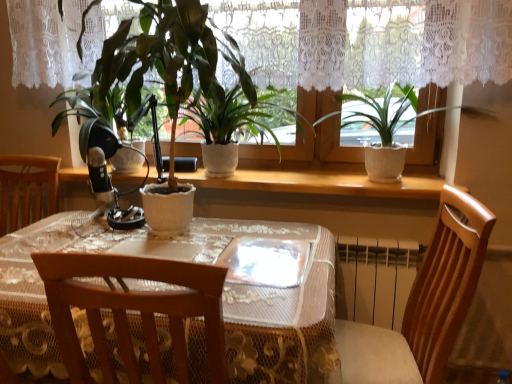
The height and width of the screenshot is (384, 512). I want to click on white ceramic plant pot at center, so click(320, 183).

The height and width of the screenshot is (384, 512). I want to click on white ceramic pot at center, which is counted as the second houseplant, starting from the right, so click(167, 75).

In order to click on white ceramic plant pot at center in this screenshot , I will do `click(320, 183)`.

Is the depth of white ceramic pot at center, arranged as the first houseplant when viewed from the left, greater than that of white textured pot at upper right, the first houseplant in the right-to-left sequence?

No, it is not.

From the image's perspective, is white ceramic pot at center, arranged as the first houseplant when viewed from the left, beneath white textured pot at upper right, the first houseplant in the right-to-left sequence?

Actually, white ceramic pot at center, arranged as the first houseplant when viewed from the left, appears above white textured pot at upper right, the first houseplant in the right-to-left sequence, in the image.

Is white ceramic pot at center, which is counted as the second houseplant, starting from the right, spatially inside white textured pot at upper right, which appears as the 2th houseplant when viewed from the left, or outside of it?

white ceramic pot at center, which is counted as the second houseplant, starting from the right, lies outside white textured pot at upper right, which appears as the 2th houseplant when viewed from the left.

Does wooden chair at lower right turn towards white lace tablecloth at center?

Yes, wooden chair at lower right is facing white lace tablecloth at center.

From a real-world perspective, is wooden chair at lower right located beneath white lace tablecloth at center?

No.

Considering the sizes of objects wooden chair at lower right and white lace tablecloth at center in the image provided, who is shorter, wooden chair at lower right or white lace tablecloth at center?

With less height is white lace tablecloth at center.

Can you confirm if wooden chair at lower right is smaller than white lace tablecloth at center?

Correct, wooden chair at lower right occupies less space than white lace tablecloth at center.

Does white lace tablecloth at center have a lesser width compared to white ceramic plant pot at center?

No.

From the image's perspective, which one is positioned higher, white lace tablecloth at center or white ceramic plant pot at center?

white ceramic plant pot at center is shown above in the image.

Is white lace tablecloth at center completely or partially outside of white ceramic plant pot at center?

white lace tablecloth at center is positioned outside white ceramic plant pot at center.

Is point (10, 246) less distant than point (392, 197)?

Yes, it is in front of point (392, 197).

Is white ceramic plant pot at center at the left side of white textured pot at upper right, which appears as the 2th houseplant when viewed from the left?

Yes, white ceramic plant pot at center is to the left of white textured pot at upper right, which appears as the 2th houseplant when viewed from the left.

Is white ceramic plant pot at center aimed at white textured pot at upper right, the first houseplant in the right-to-left sequence?

No, white ceramic plant pot at center is not oriented towards white textured pot at upper right, the first houseplant in the right-to-left sequence.

Is white textured pot at upper right, which appears as the 2th houseplant when viewed from the left, inside white ceramic plant pot at center?

No, white textured pot at upper right, which appears as the 2th houseplant when viewed from the left, is located outside of white ceramic plant pot at center.

In the image, is white ceramic plant pot at center positioned in front of or behind white textured pot at upper right, which appears as the 2th houseplant when viewed from the left?

Clearly, white ceramic plant pot at center is behind white textured pot at upper right, which appears as the 2th houseplant when viewed from the left.

Can you confirm if wooden chair at lower right is wider than white textured pot at upper right, the first houseplant in the right-to-left sequence?

Correct, the width of wooden chair at lower right exceeds that of white textured pot at upper right, the first houseplant in the right-to-left sequence.

Relative to white textured pot at upper right, the first houseplant in the right-to-left sequence, is wooden chair at lower right in front or behind?

In the image, wooden chair at lower right appears in front of white textured pot at upper right, the first houseplant in the right-to-left sequence.

Considering the sizes of objects wooden chair at lower right and white textured pot at upper right, which appears as the 2th houseplant when viewed from the left, in the image provided, who is smaller, wooden chair at lower right or white textured pot at upper right, which appears as the 2th houseplant when viewed from the left,?

With smaller size is white textured pot at upper right, which appears as the 2th houseplant when viewed from the left.

Is point (133, 88) closer to camera compared to point (260, 284)?

No, (133, 88) is behind (260, 284).

Which is behind, white ceramic pot at center, which is counted as the second houseplant, starting from the right, or transparent plastic plate at center?

transparent plastic plate at center is further away from the camera.

From a real-world perspective, which object stands above the other?

white ceramic pot at center, arranged as the first houseplant when viewed from the left.

Can you tell me how much white ceramic pot at center, which is counted as the second houseplant, starting from the right, and transparent plastic plate at center differ in facing direction?

The angle between the facing direction of white ceramic pot at center, which is counted as the second houseplant, starting from the right, and the facing direction of transparent plastic plate at center is 4.8 degrees.

You are a GUI agent. You are given a task and a screenshot of the screen. Output one action in this format:
    pyautogui.click(x=<x>, y=<y>)
    Task: Click on the houseplant on the left of the transparent plastic plate at center
    Image resolution: width=512 pixels, height=384 pixels.
    Given the screenshot: What is the action you would take?
    pyautogui.click(x=167, y=75)

Considering the sizes of objects transparent plastic plate at center and white ceramic pot at center, which is counted as the second houseplant, starting from the right, in the image provided, who is thinner, transparent plastic plate at center or white ceramic pot at center, which is counted as the second houseplant, starting from the right,?

transparent plastic plate at center is thinner.

Would you say transparent plastic plate at center is inside or outside white ceramic pot at center, arranged as the first houseplant when viewed from the left?

transparent plastic plate at center is spatially situated outside white ceramic pot at center, arranged as the first houseplant when viewed from the left.

Locate an element on the screen. The image size is (512, 384). houseplant on the right side of white ceramic pot at center, arranged as the first houseplant when viewed from the left is located at coordinates (335, 143).

Find the location of a particular element. This screenshot has height=384, width=512. chair above the white lace tablecloth at center (from the image's perspective) is located at coordinates (425, 303).

Looking at the image, which one is located further to white ceramic plant pot at center, wooden chair at lower right or white textured pot at upper right, which appears as the 2th houseplant when viewed from the left?

wooden chair at lower right lies further to white ceramic plant pot at center than the other object.

Looking at this image, looking at the image, which one is located closer to wooden chair at lower right, white lace tablecloth at center or white ceramic pot at center, which is counted as the second houseplant, starting from the right?

white lace tablecloth at center is positioned closer to the anchor wooden chair at lower right.

Looking at this image, from the image, which object appears to be nearer to white ceramic plant pot at center, white ceramic pot at center, arranged as the first houseplant when viewed from the left, or white lace tablecloth at center?

The object closer to white ceramic plant pot at center is white ceramic pot at center, arranged as the first houseplant when viewed from the left.

Which object lies further to the anchor point white lace tablecloth at center, white ceramic pot at center, arranged as the first houseplant when viewed from the left, or white textured pot at upper right, which appears as the 2th houseplant when viewed from the left?

white textured pot at upper right, which appears as the 2th houseplant when viewed from the left, is further to white lace tablecloth at center.

From the image, which object appears to be farther from transparent plastic plate at center, white ceramic pot at center, arranged as the first houseplant when viewed from the left, or white textured pot at upper right, which appears as the 2th houseplant when viewed from the left?

white textured pot at upper right, which appears as the 2th houseplant when viewed from the left.

Considering their positions, is white textured pot at upper right, the first houseplant in the right-to-left sequence, positioned closer to transparent plastic plate at center than white lace tablecloth at center?

The object closer to transparent plastic plate at center is white lace tablecloth at center.

Based on their spatial positions, is white ceramic pot at center, which is counted as the second houseplant, starting from the right, or transparent plastic plate at center further from white ceramic plant pot at center?

transparent plastic plate at center.

Considering their positions, is wooden chair at lower right positioned closer to white textured pot at upper right, the first houseplant in the right-to-left sequence, than white ceramic plant pot at center?

Based on the image, white ceramic plant pot at center appears to be nearer to white textured pot at upper right, the first houseplant in the right-to-left sequence.

You are a GUI agent. You are given a task and a screenshot of the screen. Output one action in this format:
    pyautogui.click(x=<x>, y=<y>)
    Task: Click on the glass plate between white textured pot at upper right, which appears as the 2th houseplant when viewed from the left, and wooden chair at lower right in the up-down direction
    
    Given the screenshot: What is the action you would take?
    pyautogui.click(x=265, y=262)

This screenshot has width=512, height=384. What are the coordinates of `glass plate between wooden chair at lower right and white ceramic plant pot at center in the front-back direction` in the screenshot? It's located at (265, 262).

The image size is (512, 384). I want to click on window sill between white ceramic pot at center, which is counted as the second houseplant, starting from the right, and white textured pot at upper right, the first houseplant in the right-to-left sequence, so click(x=320, y=183).

Find the location of a particular element. glass plate between white ceramic pot at center, arranged as the first houseplant when viewed from the left, and wooden chair at lower right from top to bottom is located at coordinates (265, 262).